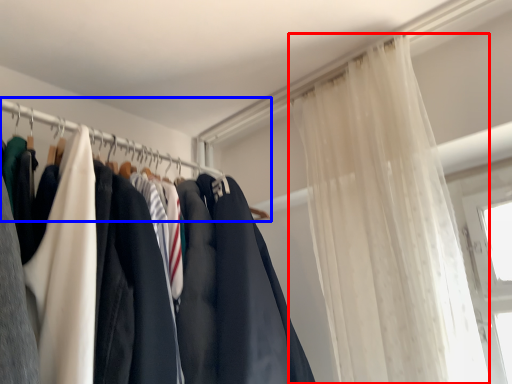
Question: Which point is further to the camera, curtain (highlighted by a red box) or clothesline (highlighted by a blue box)?

Choices:
 (A) curtain
 (B) clothesline

Answer: (B)